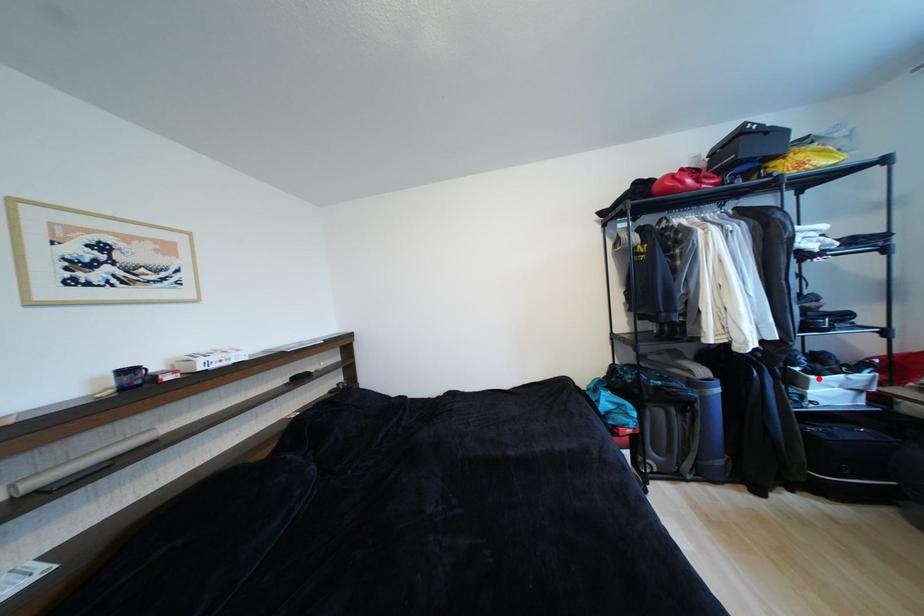
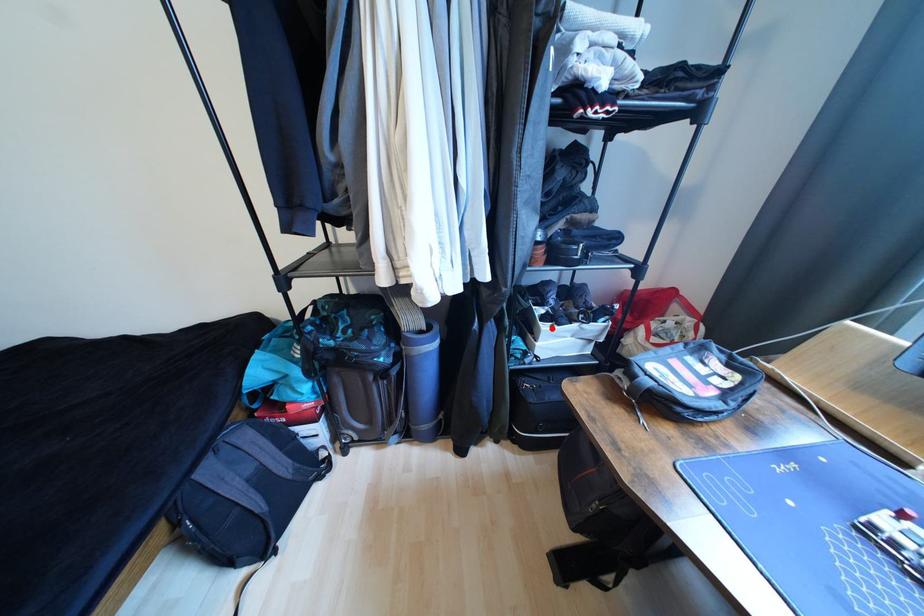
I am providing you with two images of the same scene from different viewpoints. A red point is marked on the first image and another point is marked on the second image. Are the points marked in image1 and image2 representing the same 3D position?

Yes